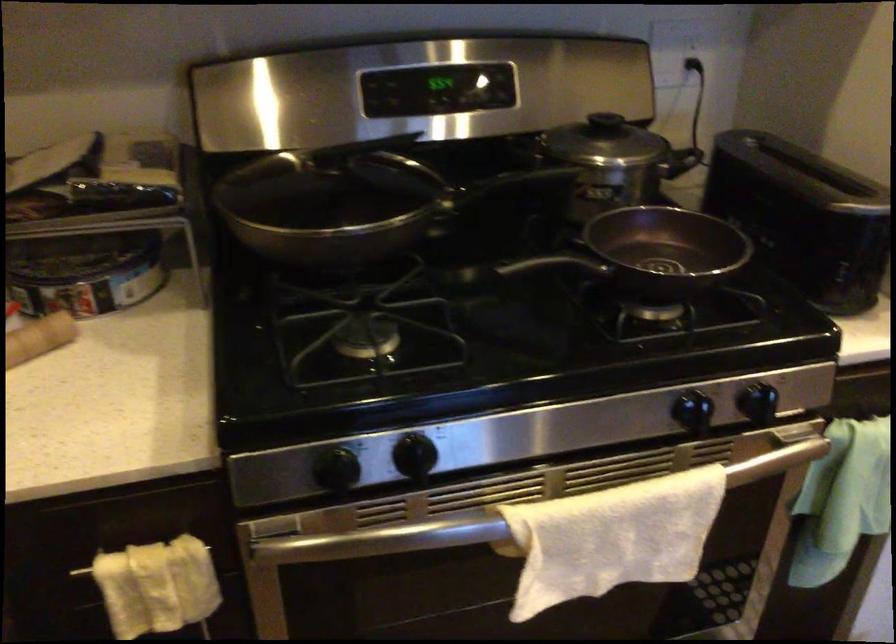
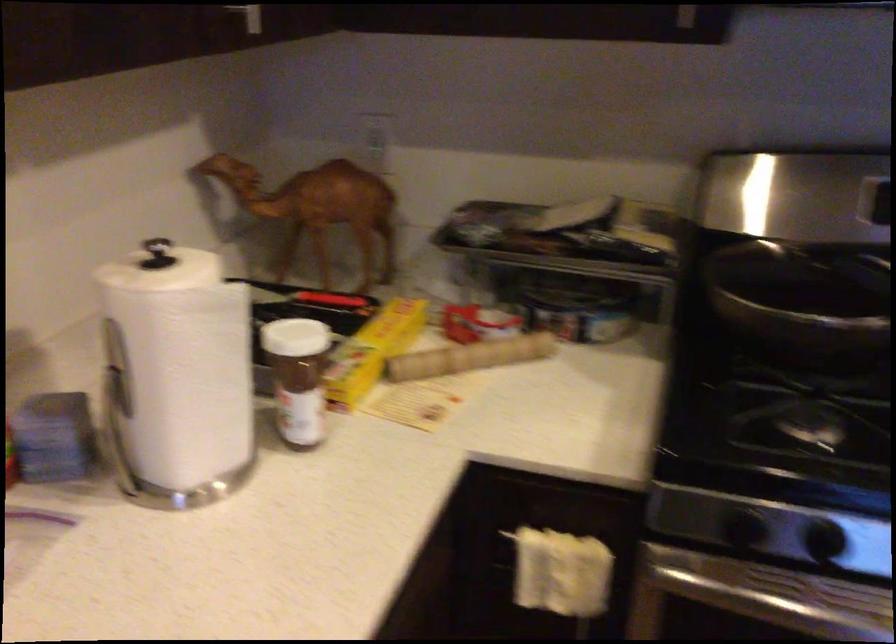
Where in the second image is the point corresponding to (360,532) from the first image?

(756, 596)